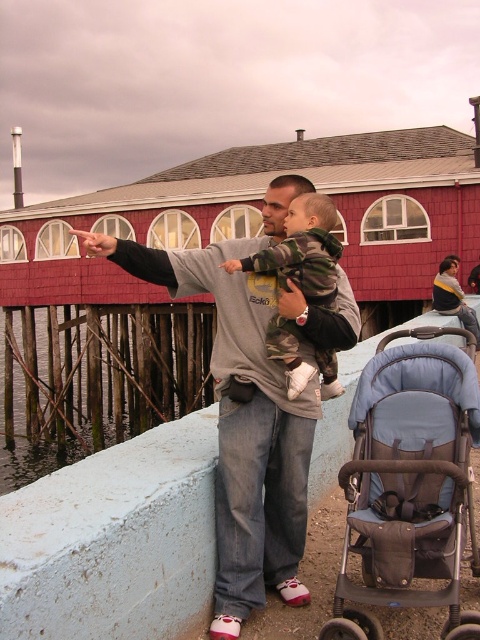
Question: In this image, where is gray cotton sweatshirt at center located relative to blue fabric stroller at lower right?

Choices:
 (A) left
 (B) right

Answer: (A)

Question: Does gray cotton sweatshirt at center have a lesser width compared to camouflage fabric baby at center?

Choices:
 (A) no
 (B) yes

Answer: (A)

Question: Considering the real-world distances, which object is farthest from the blue fabric stroller at lower right?

Choices:
 (A) gray cotton sweatshirt at center
 (B) camouflage fabric baby at center

Answer: (B)

Question: Can you confirm if gray cotton sweatshirt at center is smaller than blue fabric stroller at lower right?

Choices:
 (A) yes
 (B) no

Answer: (B)

Question: Estimate the real-world distances between objects in this image. Which object is closer to the camouflage fabric baby at center?

Choices:
 (A) blue fabric stroller at lower right
 (B) gray cotton sweatshirt at center

Answer: (B)

Question: Estimate the real-world distances between objects in this image. Which object is closer to the blue fabric stroller at lower right?

Choices:
 (A) gray cotton sweatshirt at center
 (B) camouflage fabric baby at center
 (C) clear water at lower left

Answer: (A)